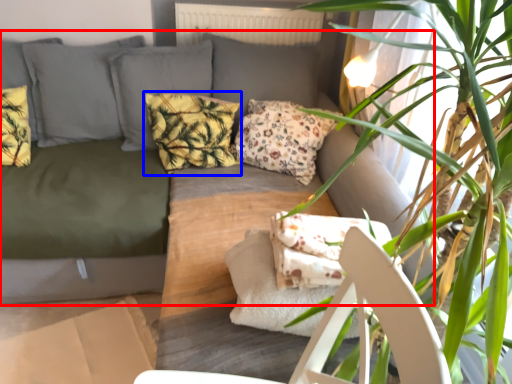
Question: Which of the following is the farthest to the observer, studio couch (highlighted by a red box) or pillow (highlighted by a blue box)?

Choices:
 (A) studio couch
 (B) pillow

Answer: (B)